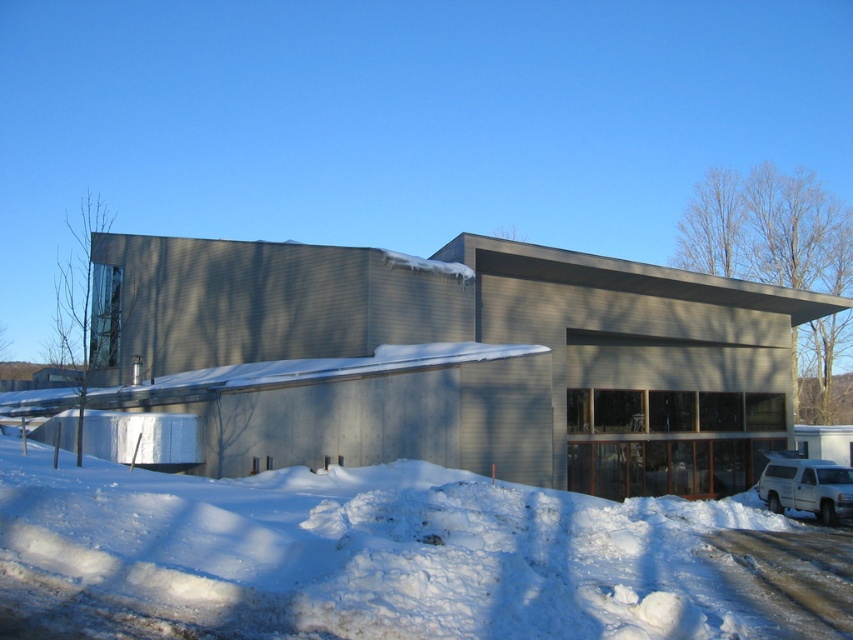
Does white fluffy snow at lower center have a lesser height compared to white matte suv at lower right?

No, white fluffy snow at lower center is not shorter than white matte suv at lower right.

Between point (737, 582) and point (767, 481), which one is positioned in front?

Point (737, 582) is in front.

Measure the distance between point (375, 620) and camera.

Point (375, 620) is 5.93 meters away from camera.

Locate an element on the screen. white fluffy snow at lower center is located at coordinates (396, 557).